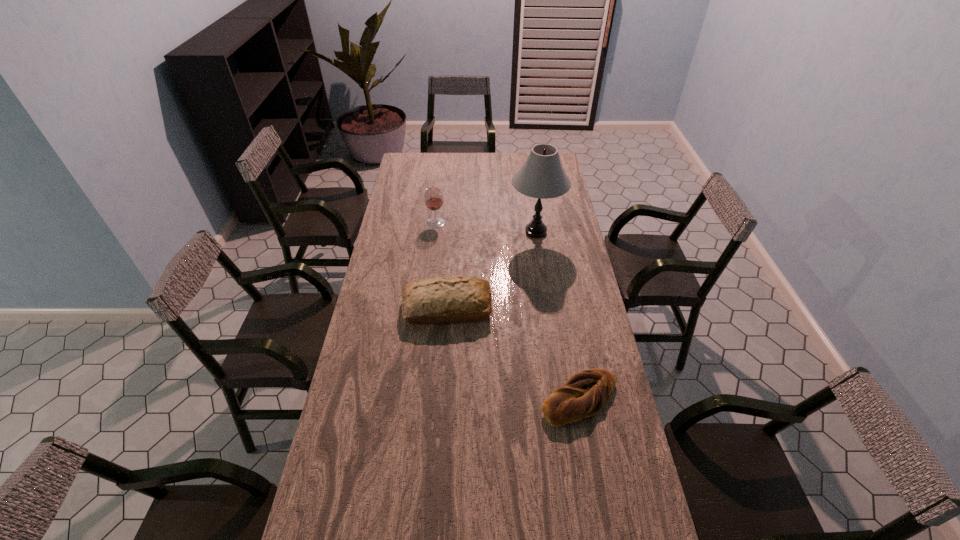
Image resolution: width=960 pixels, height=540 pixels. What are the coordinates of `lamp` in the screenshot? It's located at (542, 176).

Locate an element on the screen. the second tallest object is located at coordinates (433, 197).

The width and height of the screenshot is (960, 540). What are the coordinates of `the farther bread` in the screenshot? It's located at (454, 299).

This screenshot has width=960, height=540. Identify the location of the third farthest object. (454, 299).

Where is `the shortest object`? the shortest object is located at coordinates (585, 393).

The image size is (960, 540). What are the coordinates of `the shorter bread` in the screenshot? It's located at (585, 393).

Where is `vacant position located on the back of the lamp`? This screenshot has width=960, height=540. vacant position located on the back of the lamp is located at coordinates (531, 196).

Find the location of a particular element. The height and width of the screenshot is (540, 960). free space located 0.340m on the back of the third shortest object is located at coordinates (441, 180).

Where is `vacant space located on the front of the taller bread`? vacant space located on the front of the taller bread is located at coordinates 444,345.

Locate an element on the screen. free space located on the back of the shortest object is located at coordinates (566, 326).